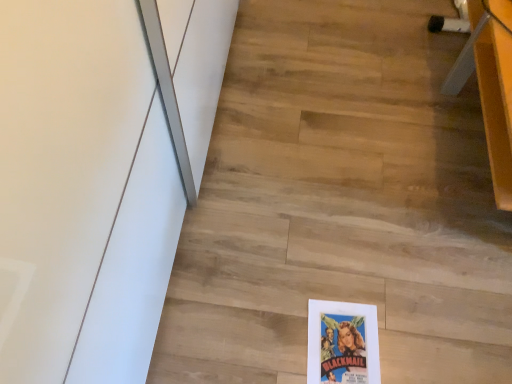
Where is `free space to the left of wooden desk at upper right`? This screenshot has width=512, height=384. free space to the left of wooden desk at upper right is located at coordinates (347, 137).